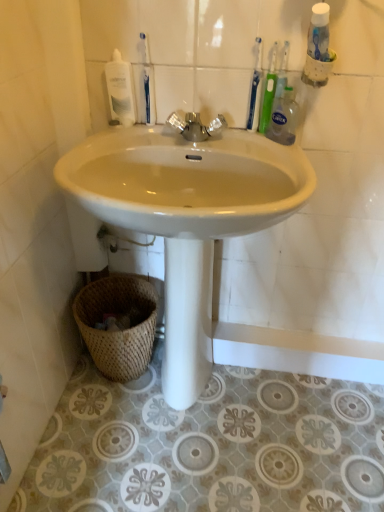
In order to click on free location in front of green plastic toothbrush at upper right, which is the 3th toothbrush from left to right in this screenshot , I will do `click(270, 151)`.